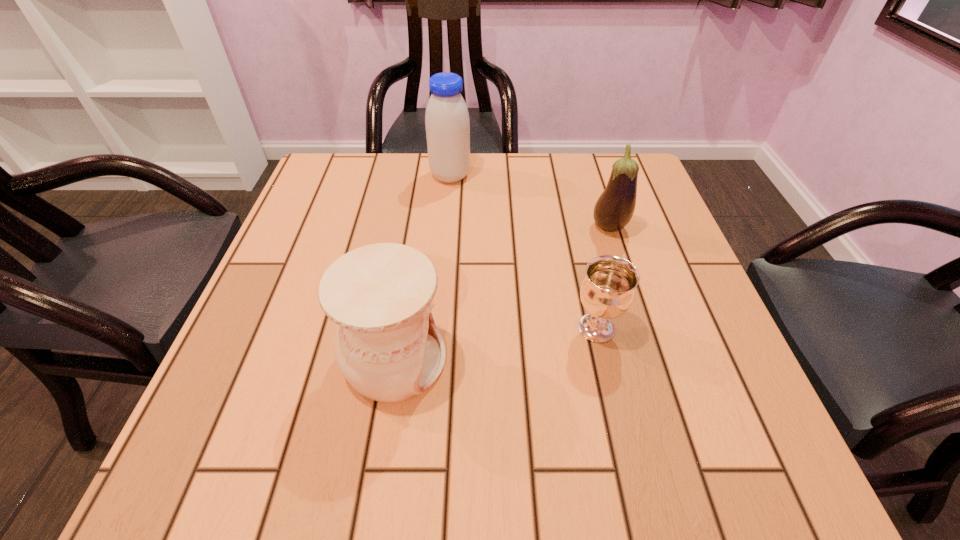
Locate an element on the screen. Image resolution: width=960 pixels, height=540 pixels. the farthest object is located at coordinates (447, 123).

Where is `the tallest object`? Image resolution: width=960 pixels, height=540 pixels. the tallest object is located at coordinates (447, 123).

Find the location of a particular element. This screenshot has height=540, width=960. eggplant is located at coordinates (615, 207).

I want to click on pottery, so click(387, 346).

Locate an element on the screen. chalice is located at coordinates click(607, 291).

The image size is (960, 540). In order to click on free space located 0.080m on the right of the farthest object in this screenshot , I will do `click(501, 176)`.

In order to click on vacant space situated 0.240m on the front of the third nearest object in this screenshot , I will do [x=640, y=328].

In order to click on free region located 0.250m at the open side of the pottery in this screenshot , I will do `click(592, 360)`.

Find the location of `vacant region located on the left of the shortest object`. vacant region located on the left of the shortest object is located at coordinates (523, 328).

This screenshot has width=960, height=540. What are the coordinates of `object positioned at the far edge` in the screenshot? It's located at (447, 123).